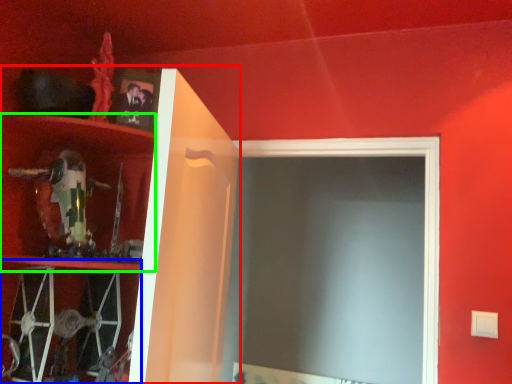
Question: Considering the real-world distances, which object is farthest from cabinet (highlighted by a red box)? cabinet (highlighted by a blue box) or cabinet (highlighted by a green box)?

Choices:
 (A) cabinet
 (B) cabinet

Answer: (A)